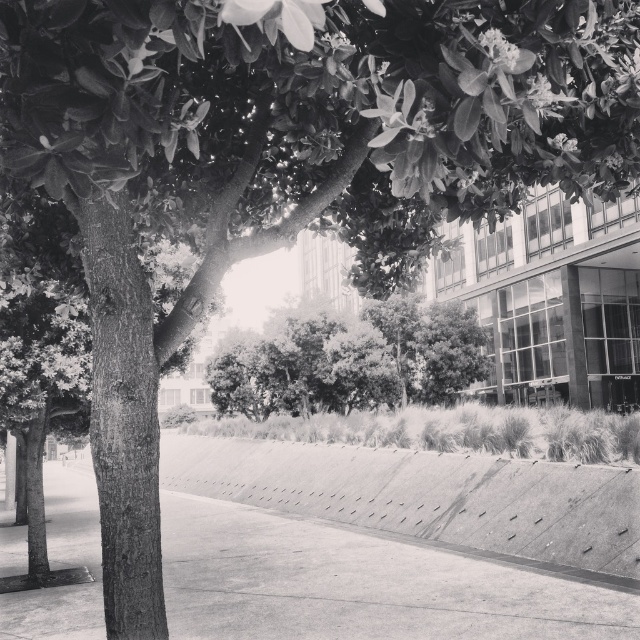
Can you confirm if smooth concrete pavement at center is positioned to the right of green leafy tree at center?

No, smooth concrete pavement at center is not to the right of green leafy tree at center.

Find the location of a particular element. This screenshot has height=640, width=640. smooth concrete pavement at center is located at coordinates (358, 584).